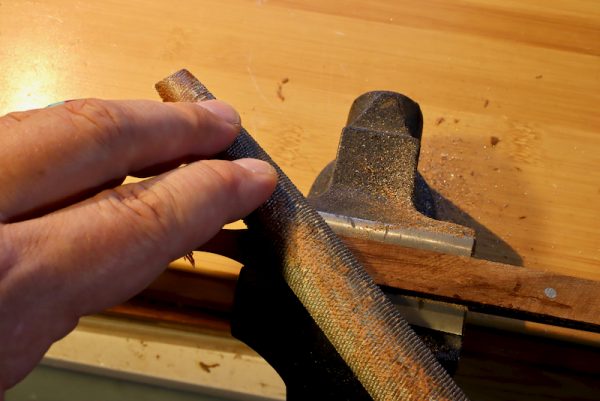
This screenshot has height=401, width=600. Find the location of `rod`. rod is located at coordinates (355, 301).